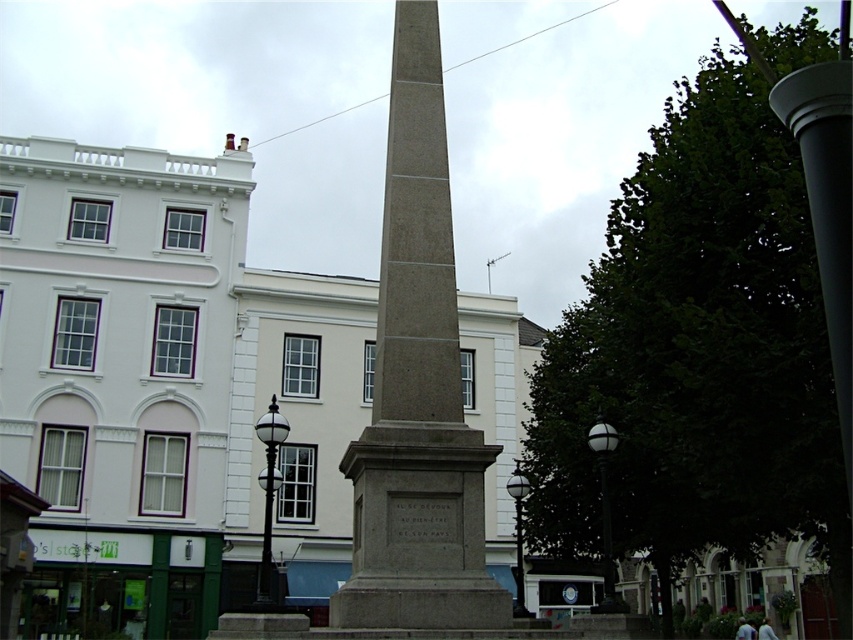
You are an architect visiting the public square and want to compare the two central structures. Which one is taller between the gray stone obelisk at center and the black polished lamp post at center?

The gray stone obelisk at center is taller than the black polished lamp post at center.